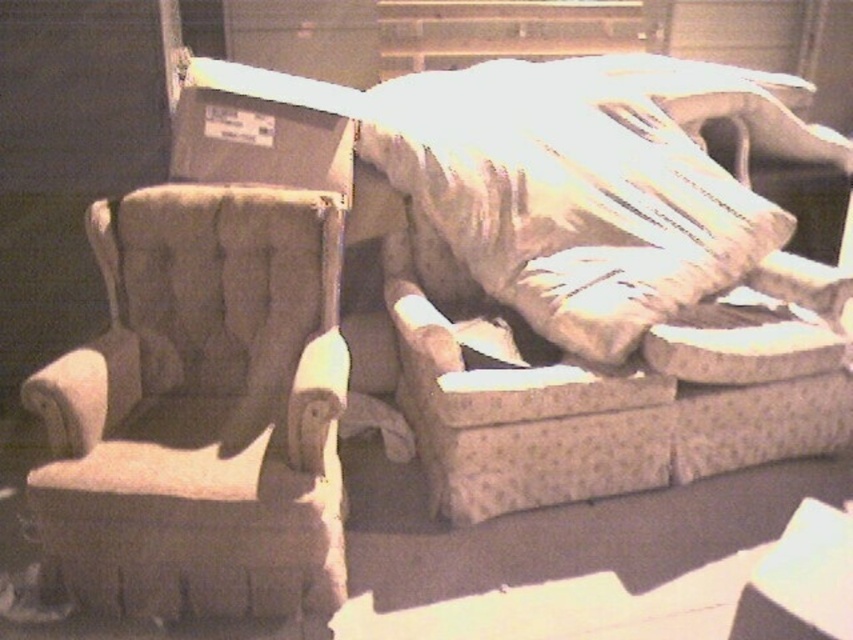
Question: Is tufted fabric armchair at left thinner than matte gray cardboard box at upper left?

Choices:
 (A) no
 (B) yes

Answer: (A)

Question: Which of the following is the farthest from the observer?

Choices:
 (A) (352, 132)
 (B) (167, 611)

Answer: (A)

Question: Is tufted fabric armchair at left smaller than matte gray cardboard box at upper left?

Choices:
 (A) yes
 (B) no

Answer: (B)

Question: Among these points, which one is nearest to the camera?

Choices:
 (A) tap(151, 333)
 (B) tap(224, 90)

Answer: (A)

Question: Observing the image, what is the correct spatial positioning of tufted fabric armchair at left in reference to matte gray cardboard box at upper left?

Choices:
 (A) above
 (B) below

Answer: (B)

Question: Which of the following is the closest to the observer?

Choices:
 (A) (183, 173)
 (B) (106, 348)

Answer: (B)